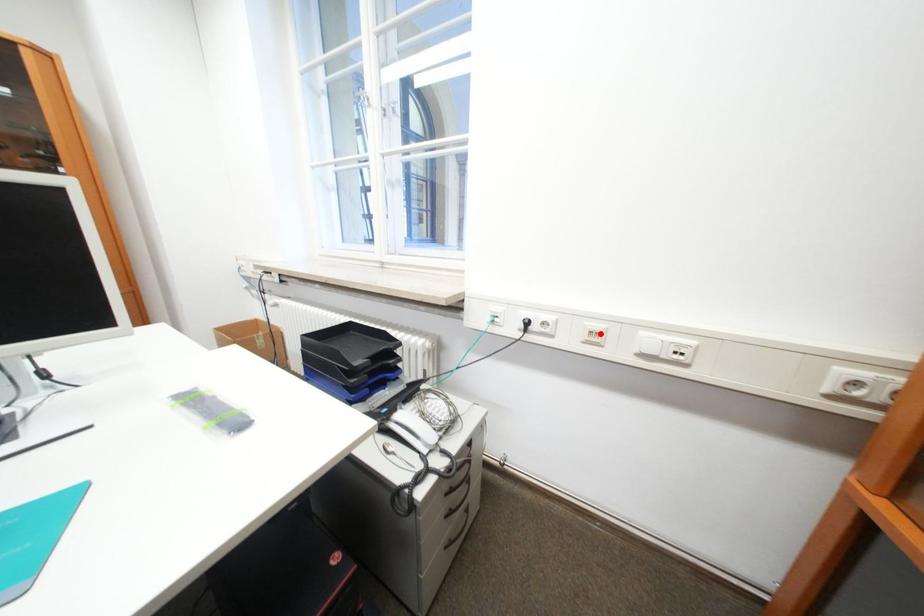
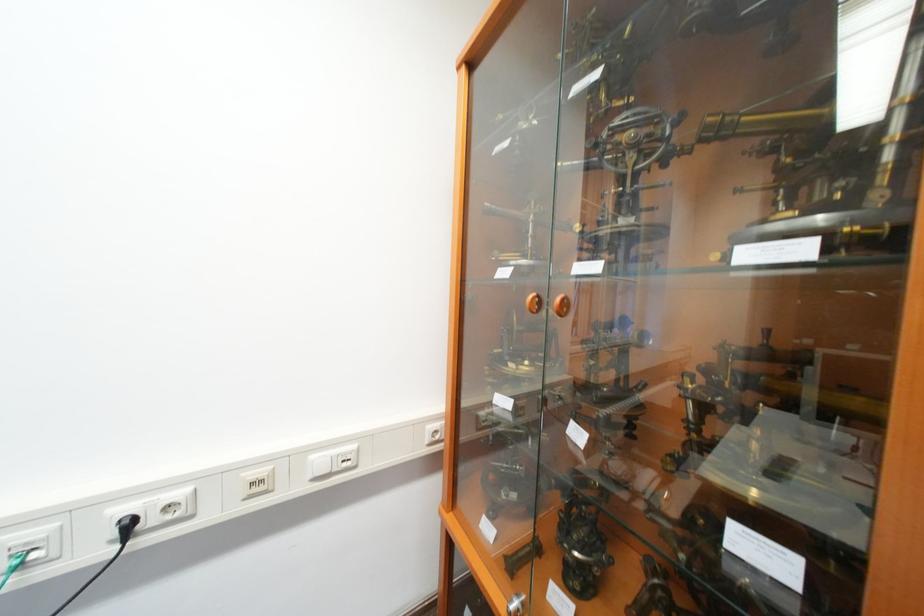
Where in the second image is the point corresponding to the highlighted location from the first image?

(261, 485)